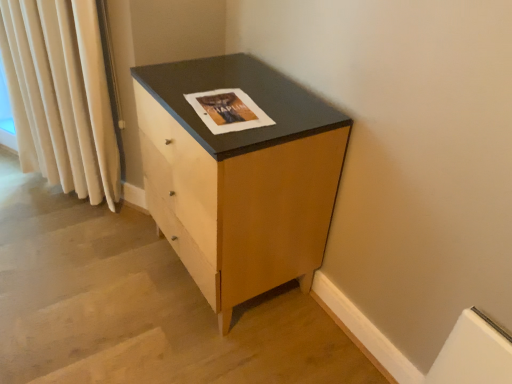
Locate an element on the screen. This screenshot has width=512, height=384. vacant space in front of matte wood chest of drawers at center is located at coordinates 202,345.